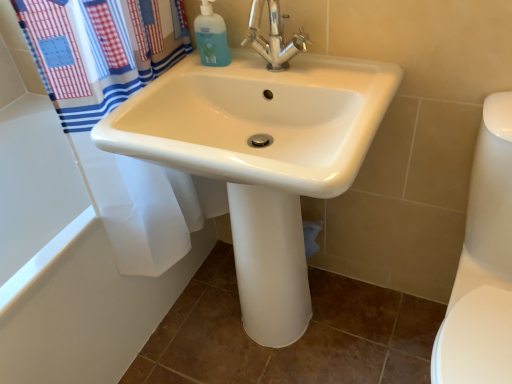
The image size is (512, 384). Identify the location of vacant location below white glossy sink at center (from a real-world perspective). (288, 347).